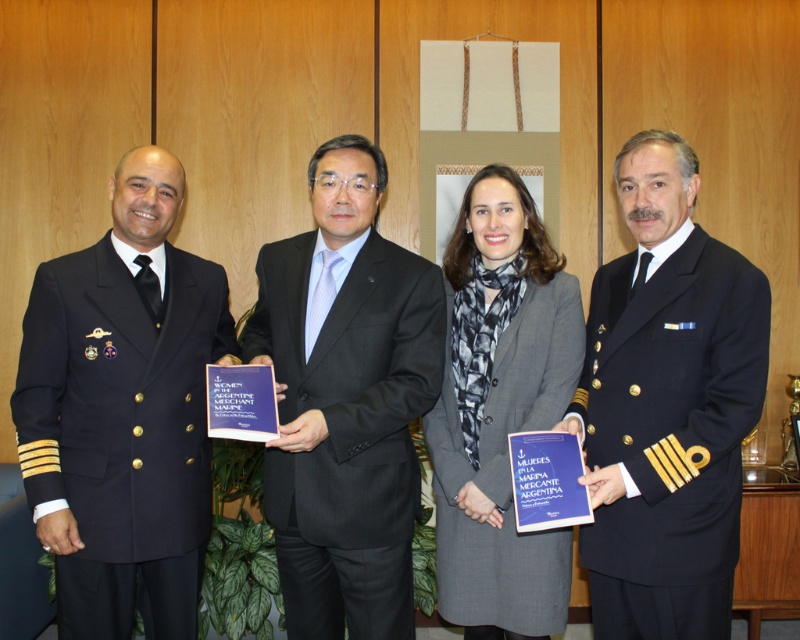
Question: Among these points, which one is farthest from the camera?

Choices:
 (A) (136, 596)
 (B) (470, 522)
 (C) (344, 356)

Answer: (A)

Question: Considering the relative positions of navy blue woolen suit at right and gray wool coat at center in the image provided, where is navy blue woolen suit at right located with respect to gray wool coat at center?

Choices:
 (A) above
 (B) below

Answer: (B)

Question: Among these points, which one is nearest to the camera?

Choices:
 (A) (380, 476)
 (B) (164, 406)
 (C) (558, 360)

Answer: (B)

Question: Is navy blue woolen suit at left smaller than gray wool coat at center?

Choices:
 (A) yes
 (B) no

Answer: (A)

Question: Does black wool suit at center appear over gray wool coat at center?

Choices:
 (A) yes
 (B) no

Answer: (B)

Question: Which object appears closest to the camera in this image?

Choices:
 (A) gray wool coat at center
 (B) navy blue woolen suit at right

Answer: (B)